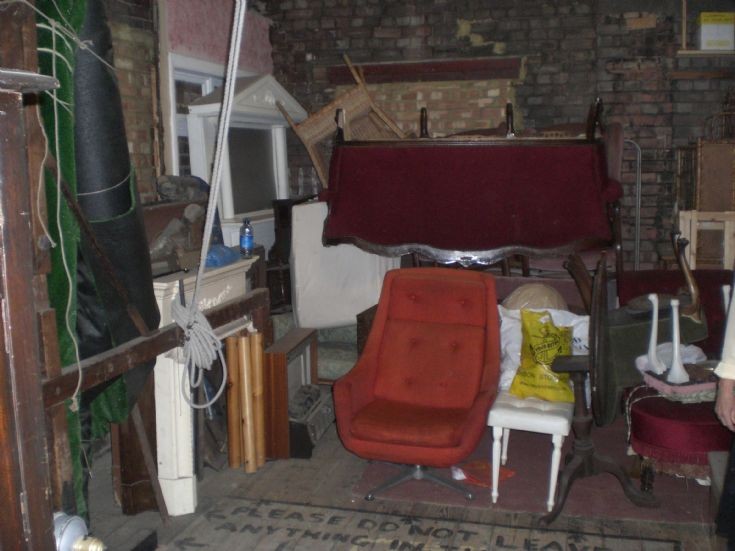
This screenshot has width=735, height=551. I want to click on bottle on the right corner of the white fireplace, so click(242, 223).